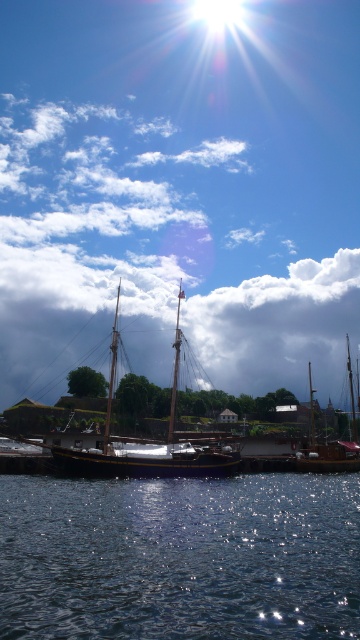
Does cloudy sky at center have a lesser height compared to shiny silver mast at center?

No, cloudy sky at center is not shorter than shiny silver mast at center.

Is cloudy sky at center thinner than shiny silver mast at center?

No.

You are a GUI agent. You are given a task and a screenshot of the screen. Output one action in this format:
    pyautogui.click(x=<x>, y=<y>)
    Task: Click on the cloudy sky at center
    
    Given the screenshot: What is the action you would take?
    pyautogui.click(x=79, y=320)

Does wooden mast at center have a greater height compared to shiny silver mast at center?

In fact, wooden mast at center may be shorter than shiny silver mast at center.

Looking at this image, can you confirm if wooden mast at center is positioned below shiny silver mast at center?

No, wooden mast at center is not below shiny silver mast at center.

Is point (106, 406) more distant than point (173, 362)?

Yes, point (106, 406) is behind point (173, 362).

You are a GUI agent. You are given a task and a screenshot of the screen. Output one action in this format:
    pyautogui.click(x=<x>, y=<y>)
    Task: Click on the wooden mast at center
    
    Given the screenshot: What is the action you would take?
    pyautogui.click(x=111, y=371)

Who is higher up, glistening dark water at lower center or shiny silver mast at center?

Positioned higher is shiny silver mast at center.

Identify the location of glistening dark water at lower center. (180, 557).